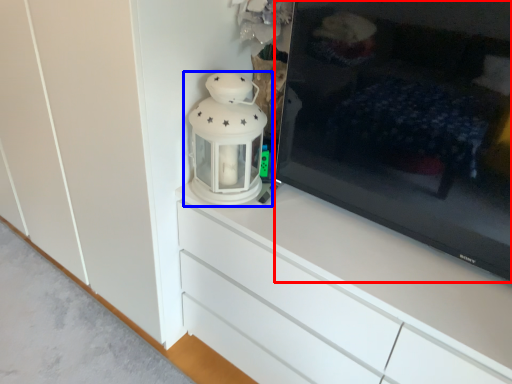
Question: Which object appears closest to the camera in this image, television (highlighted by a red box) or lantern (highlighted by a blue box)?

Choices:
 (A) television
 (B) lantern

Answer: (A)